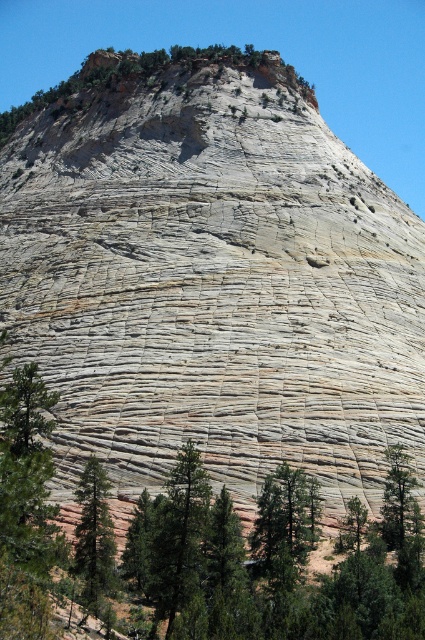
Question: Which point is farther to the camera?

Choices:
 (A) (93, 552)
 (B) (416, 502)

Answer: (B)

Question: In this image, where is green matte tree at lower left located relative to green textured tree at lower right?

Choices:
 (A) below
 (B) above

Answer: (A)

Question: From the image, what is the correct spatial relationship of green matte tree at lower left in relation to green textured tree at lower right?

Choices:
 (A) above
 (B) below

Answer: (B)

Question: Which point appears farthest from the camera in this image?

Choices:
 (A) (96, 509)
 (B) (396, 456)

Answer: (B)

Question: Can you confirm if green matte tree at lower left is smaller than green textured tree at lower right?

Choices:
 (A) no
 (B) yes

Answer: (A)

Question: Which of the following is the farthest from the observer?

Choices:
 (A) green matte tree at lower left
 (B) green textured tree at lower right

Answer: (B)